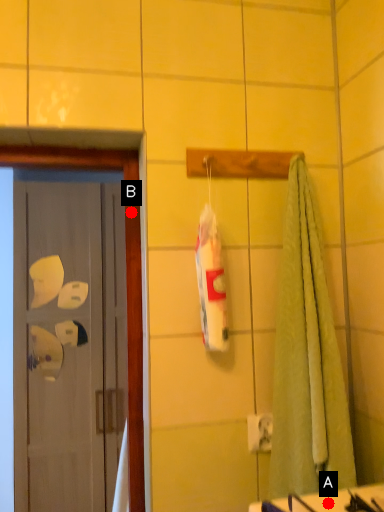
Question: Two points are circled on the image, labeled by A and B beside each circle. Which point is farther from the camera taking this photo?

Choices:
 (A) A is further
 (B) B is further

Answer: (B)